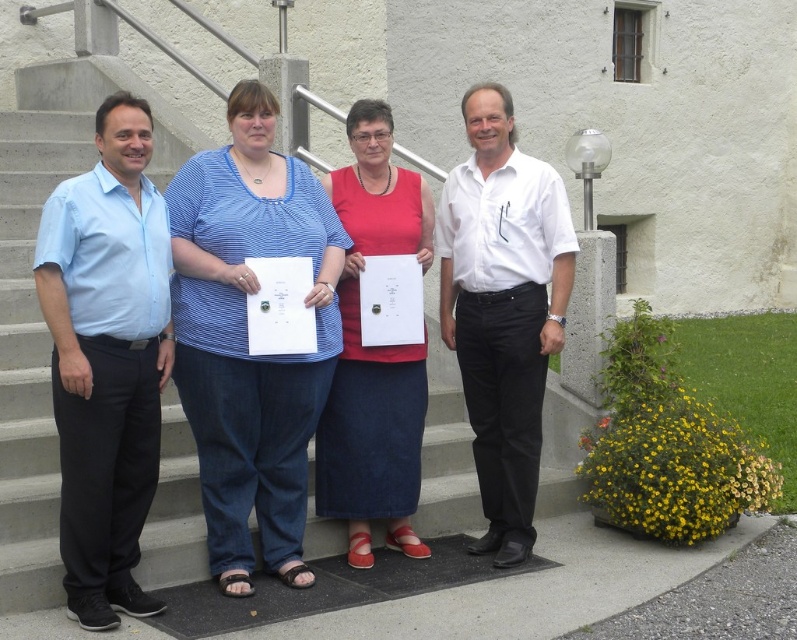
Question: Is light blue cotton shirt at left closer to the viewer compared to white smooth shirt at center?

Choices:
 (A) no
 (B) yes

Answer: (B)

Question: Does white smooth shirt at center have a greater width compared to red matte skirt at center?

Choices:
 (A) yes
 (B) no

Answer: (A)

Question: Which point is farther to the camera?

Choices:
 (A) (476, 504)
 (B) (207, 211)
 (C) (415, 227)

Answer: (A)

Question: Is light blue cotton shirt at left above white smooth shirt at center?

Choices:
 (A) no
 (B) yes

Answer: (A)

Question: Which point is farther to the camera?

Choices:
 (A) (401, 484)
 (B) (61, 348)
 (C) (371, 273)
 (D) (462, 284)

Answer: (D)

Question: Which point is farther from the camera taking this photo?

Choices:
 (A) (322, 356)
 (B) (10, 438)
 (C) (368, 298)
 (D) (116, 496)

Answer: (B)